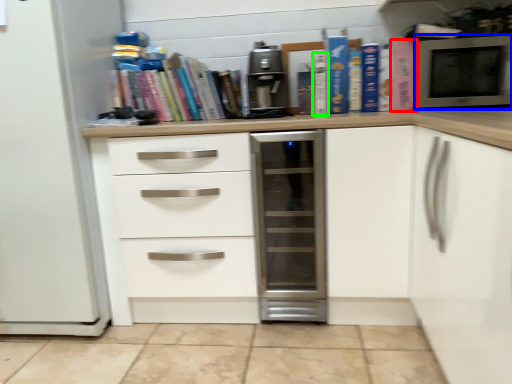
Question: Which object is the closest to the paperback book (highlighted by a red box)? Choose among these: microwave oven (highlighted by a blue box) or paperback book (highlighted by a green box).

Choices:
 (A) microwave oven
 (B) paperback book

Answer: (A)